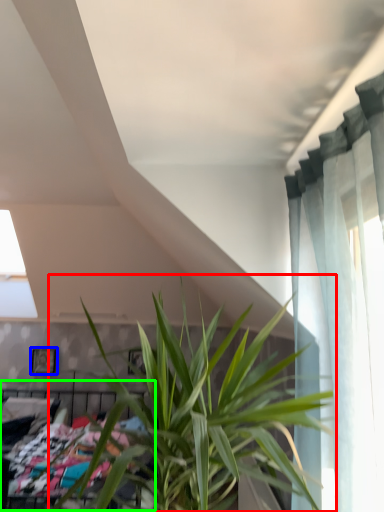
Question: Based on their relative distances, which object is nearer to houseplant (highlighted by a red box)? Choose from picture frame (highlighted by a blue box) and bed (highlighted by a green box).

Choices:
 (A) picture frame
 (B) bed

Answer: (B)